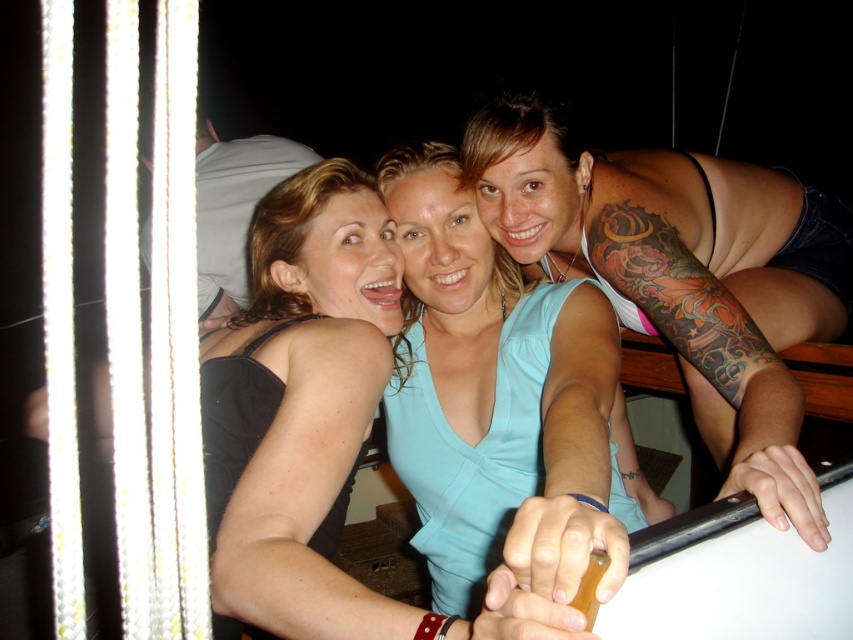
Between point (740, 428) and point (570, 472), which one is positioned behind?

Point (740, 428)

This screenshot has height=640, width=853. What are the coordinates of `blue fabric top at upper right` in the screenshot? It's located at (682, 273).

At what (x,y) coordinates should I click in order to perform the action: click on blue fabric top at upper right. Please return your answer as a coordinate pair (x, y). The image size is (853, 640). Looking at the image, I should click on (682, 273).